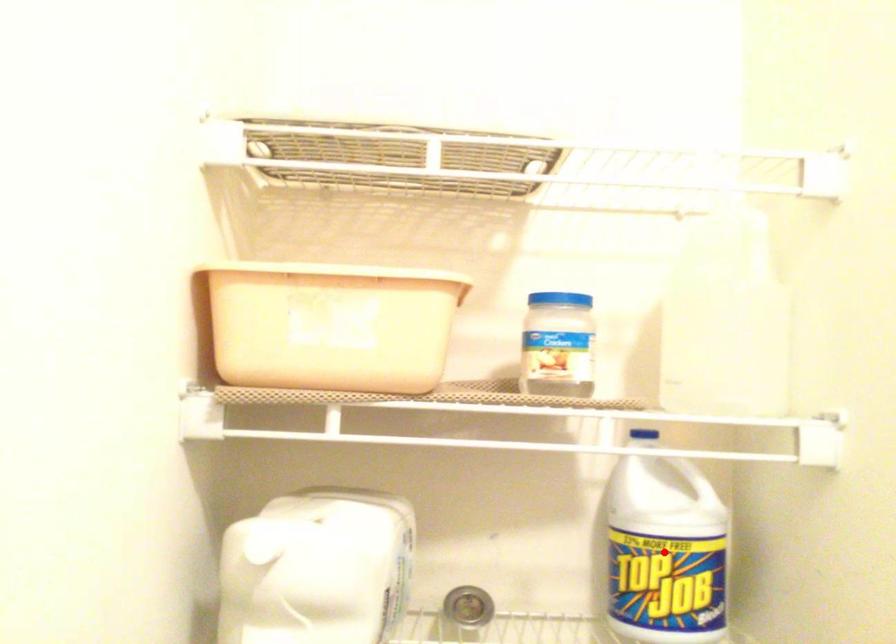
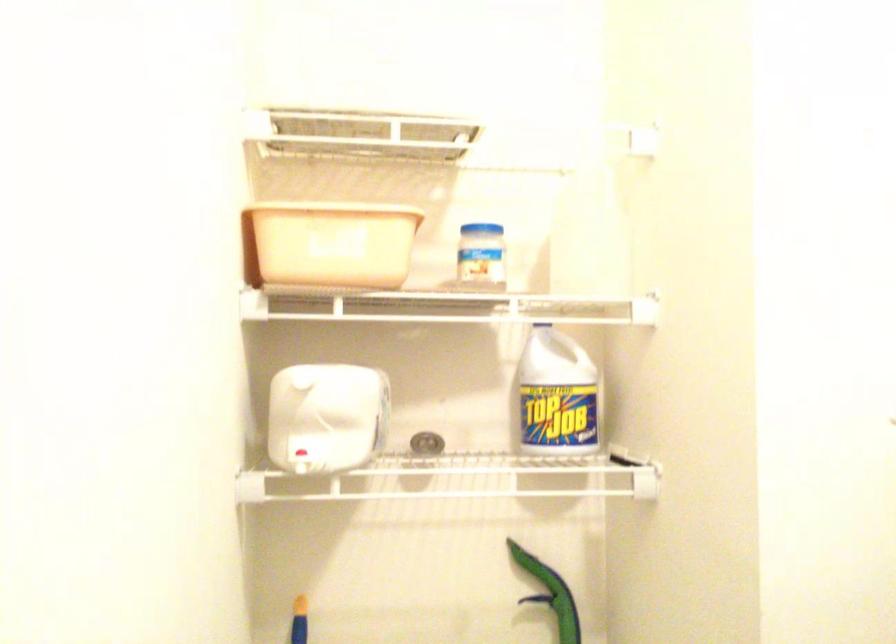
Locate, in the second image, the point that corresponds to the highlighted location in the first image.

(556, 395)